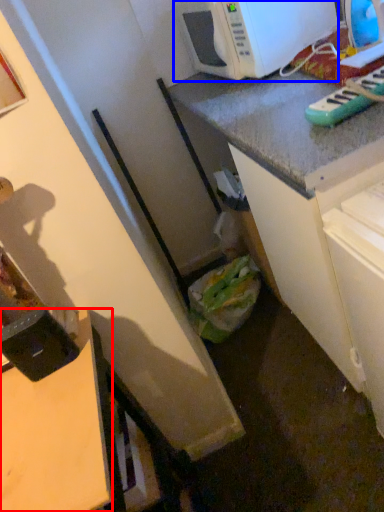
Question: Which object is further to the camera taking this photo, desk (highlighted by a red box) or microwave oven (highlighted by a blue box)?

Choices:
 (A) desk
 (B) microwave oven

Answer: (B)